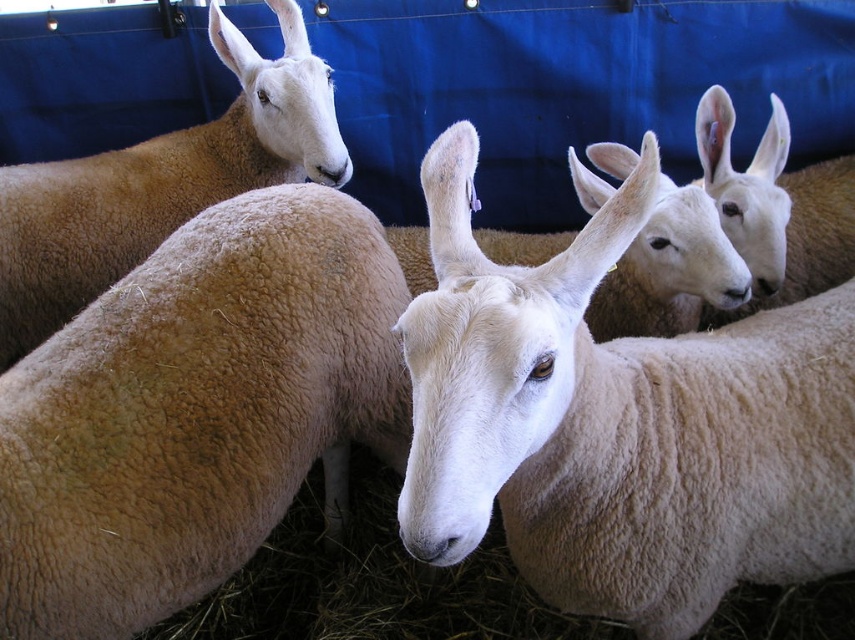
Question: Can you confirm if light brown woolen sheep at left is positioned below white woolen sheep at upper right?

Choices:
 (A) no
 (B) yes

Answer: (B)

Question: Is light brown woolly sheep at left thinner than light brown woolen sheep at left?

Choices:
 (A) no
 (B) yes

Answer: (B)

Question: Which point appears closest to the camera in this image?

Choices:
 (A) (10, 524)
 (B) (788, 177)
 (C) (735, 556)

Answer: (A)

Question: Can you confirm if white woolen goat at center is positioned to the left of white woolen sheep at upper right?

Choices:
 (A) yes
 (B) no

Answer: (A)

Question: Which is farther from the white woolen goat at center?

Choices:
 (A) white woolen sheep at upper right
 (B) light brown woolly sheep at left

Answer: (A)

Question: Which object appears farthest from the camera in this image?

Choices:
 (A) light brown woolen sheep at left
 (B) white woolen goat at center
 (C) white woolen sheep at upper right

Answer: (A)